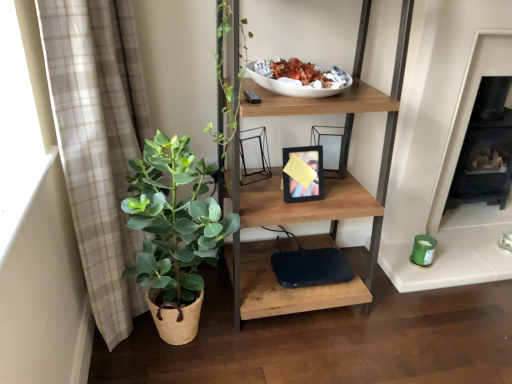
You are a GUI agent. You are given a task and a screenshot of the screen. Output one action in this format:
    pyautogui.click(x=<x>, y=<y>)
    Task: Click on the vacant space in front of wooden shelf at center
    Image resolution: width=512 pixels, height=384 pixels.
    Given the screenshot: What is the action you would take?
    pyautogui.click(x=306, y=356)